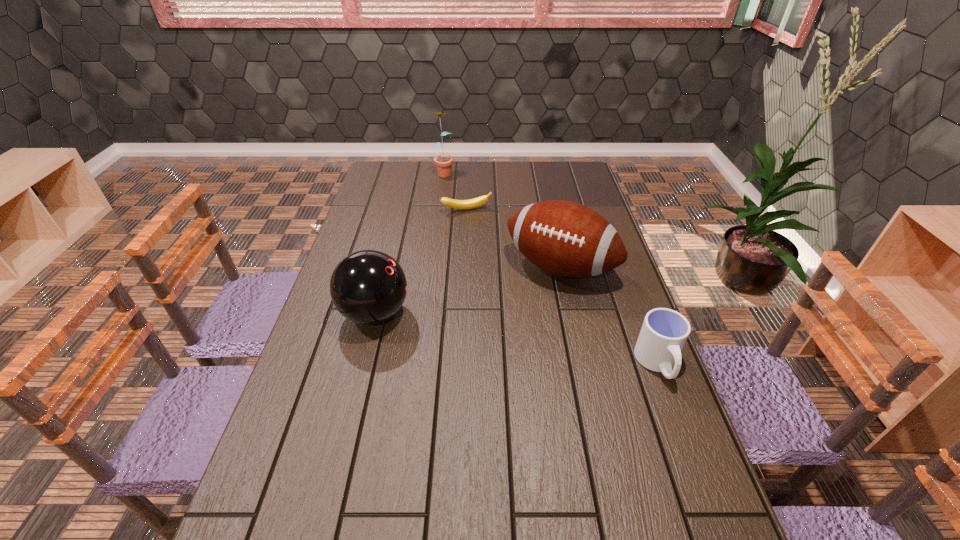
Identify the location of free space on the desktop that is between the bowling ball and the second shortest object and is positioned at the stem of the shortest object. (531, 341).

The height and width of the screenshot is (540, 960). What are the coordinates of `vacant space on the desktop that is between the bowling ball and the cup and is positioned on the laces of the football` in the screenshot? It's located at (512, 338).

Identify the location of vacant space on the desktop that is between the bowling ball and the second shortest object and is positioned on the flower of the farthest object. The height and width of the screenshot is (540, 960). (501, 336).